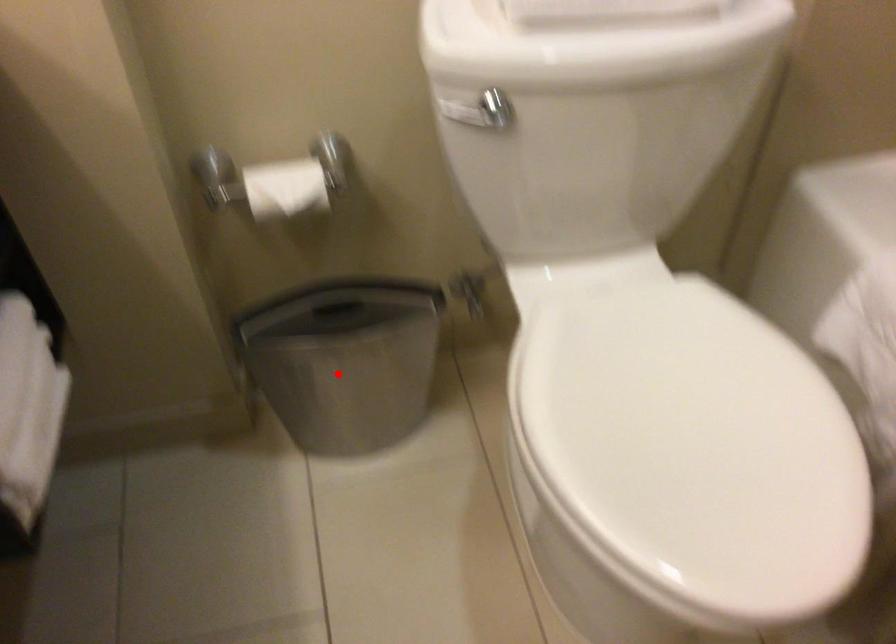
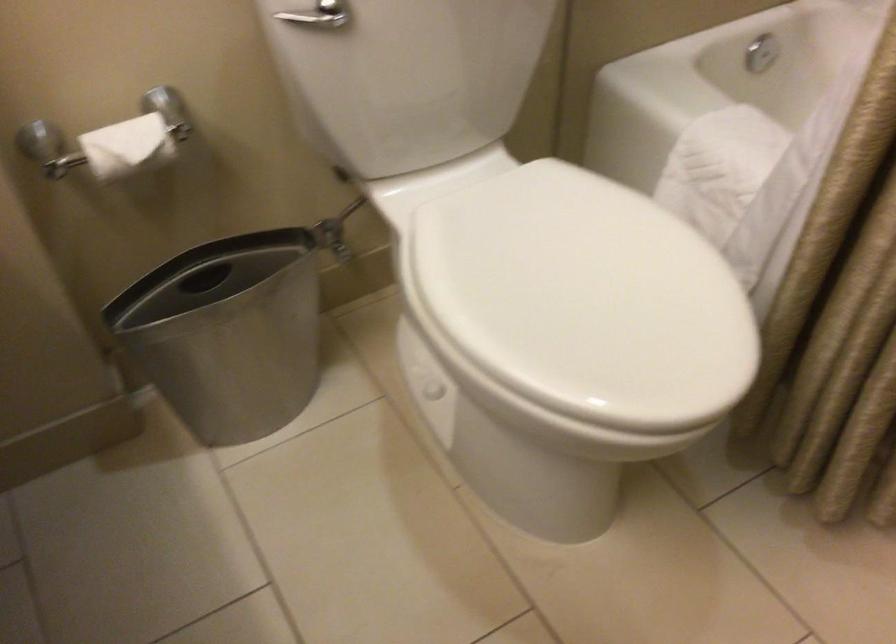
Where in the second image is the point corresponding to the highlighted location from the first image?

(228, 333)